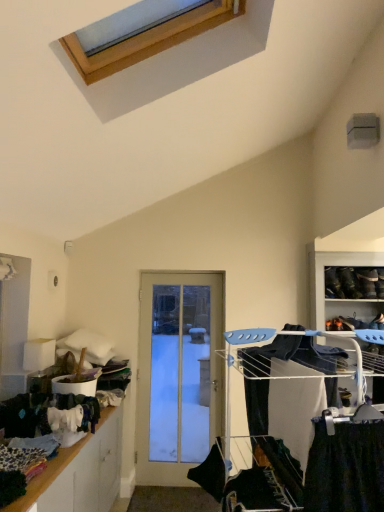
Question: From a real-world perspective, is white glass door at center above or below white metal drying rack at right?

Choices:
 (A) below
 (B) above

Answer: (A)

Question: Is white glass door at center taller or shorter than white metal drying rack at right?

Choices:
 (A) short
 (B) tall

Answer: (B)

Question: Which is farther from the white glass door at center?

Choices:
 (A) black fabric at center
 (B) white metal drying rack at right
 (C) wooden shelf at lower left

Answer: (A)

Question: Which object is positioned farthest from the white glass door at center?

Choices:
 (A) wooden shelf at lower left
 (B) white metal drying rack at right
 (C) black fabric at center

Answer: (C)